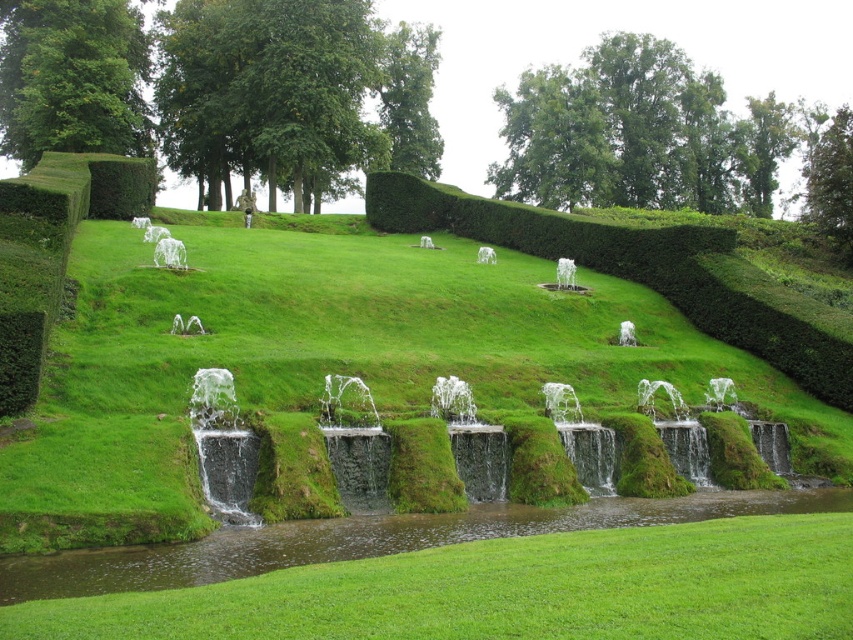
Question: Based on their relative distances, which object is farther from the green leafy hedge at upper center?

Choices:
 (A) green mossy grass at center
 (B) green mossy stone at center

Answer: (B)

Question: Is green mossy stone at center wider than green leafy hedge at upper left?

Choices:
 (A) no
 (B) yes

Answer: (B)

Question: Does green mossy grass at center appear on the right side of green leafy hedge at upper left?

Choices:
 (A) yes
 (B) no

Answer: (A)

Question: Observing the image, what is the correct spatial positioning of green mossy grass at center in reference to green mossy stone at center?

Choices:
 (A) right
 (B) left

Answer: (B)

Question: Which point is closer to the camera taking this photo?

Choices:
 (A) (45, 428)
 (B) (129, 164)
 (C) (212, 372)

Answer: (A)

Question: Which point is closer to the camera?

Choices:
 (A) green mossy stone at center
 (B) green leafy hedge at upper left
 (C) green mossy grass at center
 (D) green leafy hedge at upper center

Answer: (C)